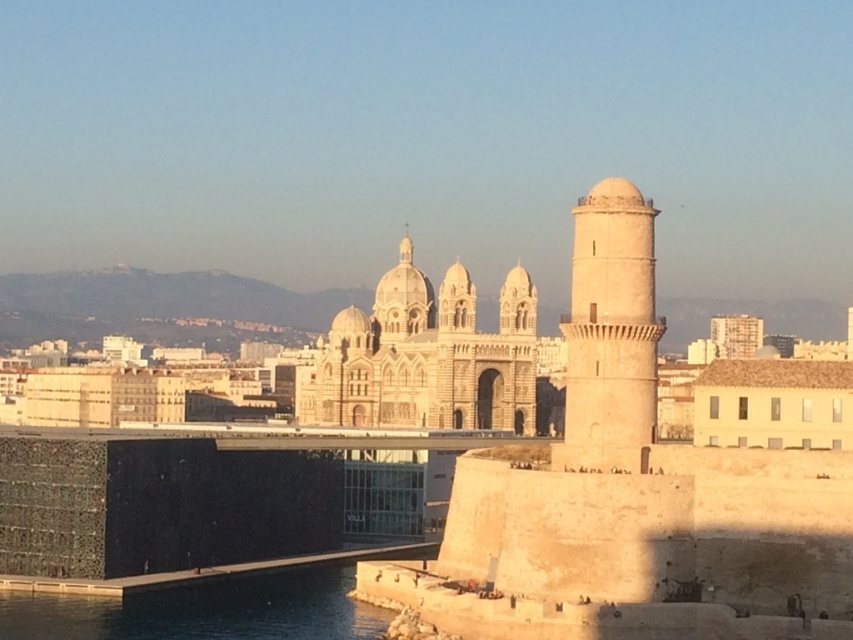
You are a tourist standing in front of the beige stone cathedral at center and the light beige stone tower at right. You want to take a photo that includes both structures. Which structure should you position closer to the bottom of the frame to ensure both are fully visible?

The beige stone cathedral at center is positioned under the light beige stone tower at right, so to include both in the photo, position the light beige stone tower at right closer to the bottom of the frame. Since the cathedral is below the tower, placing the tower lower in the frame will allow both to fit without cropping.

From the picture: You are a drone operator trying to capture a photo of the light beige stone tower at right from above. The cathedral is in the way. Can you fly the drone over the cathedral to reach the tower?

The light beige stone tower at right is located at point [610,332], which is to the right of the cathedral. Since the tower is positioned to the right of the cathedral, the drone can fly around the cathedral to the right side to get above the tower without going directly over the cathedral.

You are an architect analyzing the cityscape. You need to determine the spatial relationship between the beige stone cathedral at center and the blue glass water at lower left. Based on the scene, which object is positioned further away from the viewer?

The blue glass water at lower left is behind the beige stone cathedral at center, meaning it is further away from the viewer.